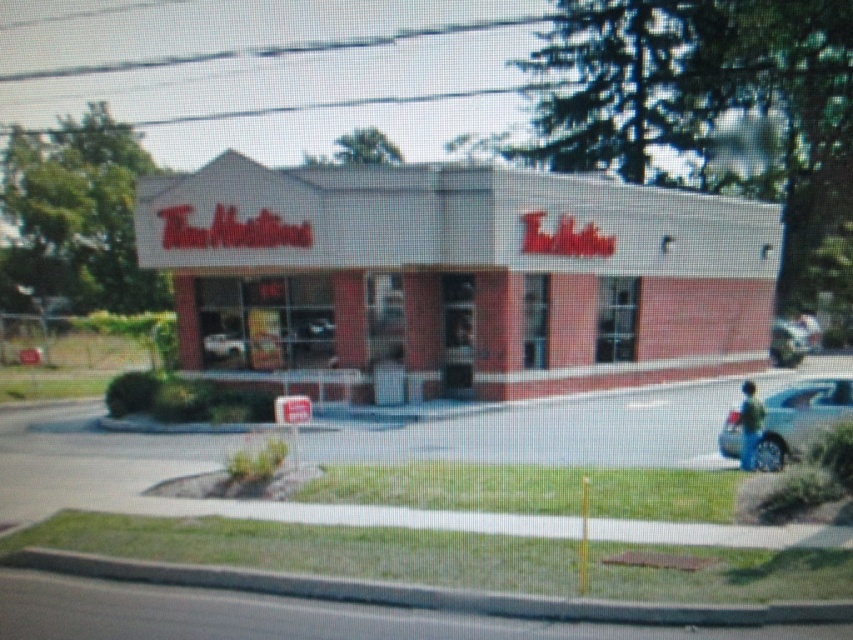
You are a delivery driver who needs to park your car at the Tim Hortons shown in the image. Your car is 5 meters long. The parking lot has a narrow path between the white brick Tim Hortons at center and the metallic silver car at right. Is the path wide enough for your car to pass through safely?

The path between the white brick Tim Hortons at center and the metallic silver car at right is 11.38 meters wide, which is more than enough for a 5 meter long car to pass through safely.